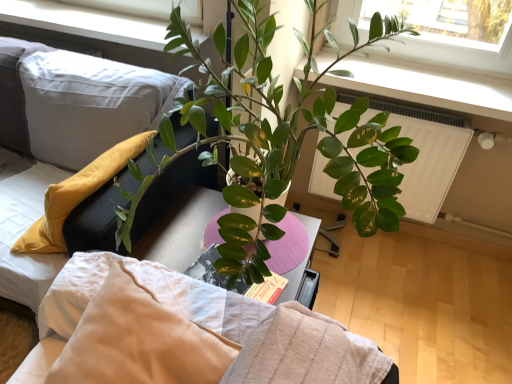
Question: Is white textured pillow at upper left outside soft white fabric couch at left?

Choices:
 (A) yes
 (B) no

Answer: (A)

Question: Can you confirm if white textured pillow at upper left is thinner than soft white fabric couch at left?

Choices:
 (A) yes
 (B) no

Answer: (A)

Question: Is white textured pillow at upper left turned away from soft white fabric couch at left?

Choices:
 (A) yes
 (B) no

Answer: (B)

Question: Is white textured pillow at upper left facing towards soft white fabric couch at left?

Choices:
 (A) yes
 (B) no

Answer: (B)

Question: Does white textured pillow at upper left appear on the left side of soft white fabric couch at left?

Choices:
 (A) yes
 (B) no

Answer: (B)

Question: Is white textured bed at center to the left or to the right of white plastic window frame at upper center in the image?

Choices:
 (A) right
 (B) left

Answer: (A)

Question: Is white textured bed at center spatially inside white plastic window frame at upper center, or outside of it?

Choices:
 (A) outside
 (B) inside

Answer: (A)

Question: From a real-world perspective, is white textured bed at center physically located above or below white plastic window frame at upper center?

Choices:
 (A) below
 (B) above

Answer: (B)

Question: Is point pos(172,228) positioned closer to the camera than point pos(50,29)?

Choices:
 (A) closer
 (B) farther

Answer: (A)

Question: Considering the relative positions of white textured pillow at upper left and soft white fabric couch at left in the image provided, is white textured pillow at upper left to the left or to the right of soft white fabric couch at left?

Choices:
 (A) right
 (B) left

Answer: (A)

Question: Relative to soft white fabric couch at left, is white textured pillow at upper left in front or behind?

Choices:
 (A) behind
 (B) front

Answer: (B)

Question: Does point (365, 369) appear closer or farther from the camera than point (72, 122)?

Choices:
 (A) closer
 (B) farther

Answer: (A)

Question: Would you say white textured pillow at upper left is inside or outside soft white fabric couch at left?

Choices:
 (A) outside
 (B) inside

Answer: (A)

Question: Is white textured pillow at upper left in front of or behind white plastic window frame at upper center in the image?

Choices:
 (A) behind
 (B) front

Answer: (B)

Question: In terms of size, does white textured pillow at upper left appear bigger or smaller than white plastic window frame at upper center?

Choices:
 (A) small
 (B) big

Answer: (B)